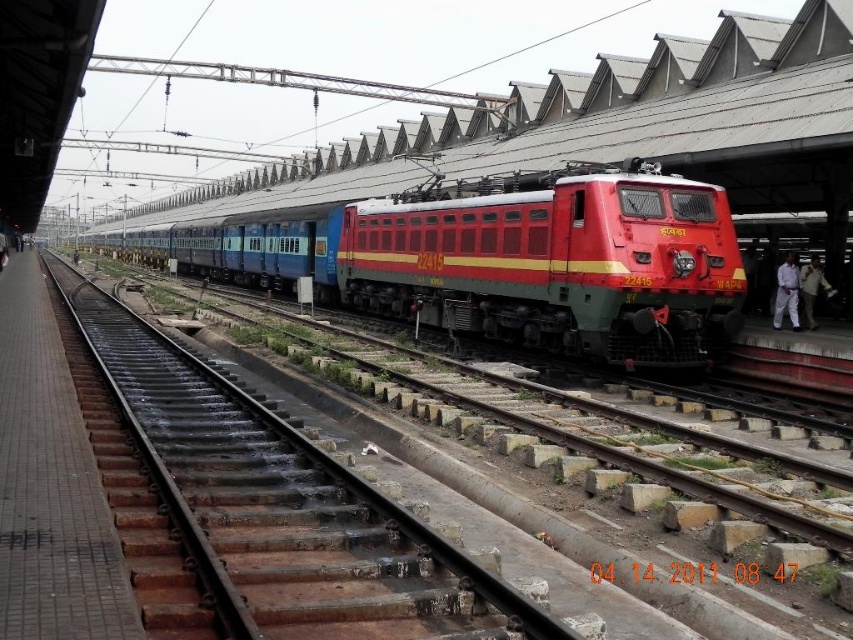
You are a passenger waiting at the railway station. You see the shiny red locomotive at center and the metal train track at center. Which object is closer to you?

The shiny red locomotive at center is closer to you because the metal train track at center is behind it.

You are a maintenance worker standing on the platform at the railway station. You need to inspect the shiny red locomotive at center and the metal train track at center. How far apart are these two objects?

The shiny red locomotive at center is 33.03 feet away from the metal train track at center.